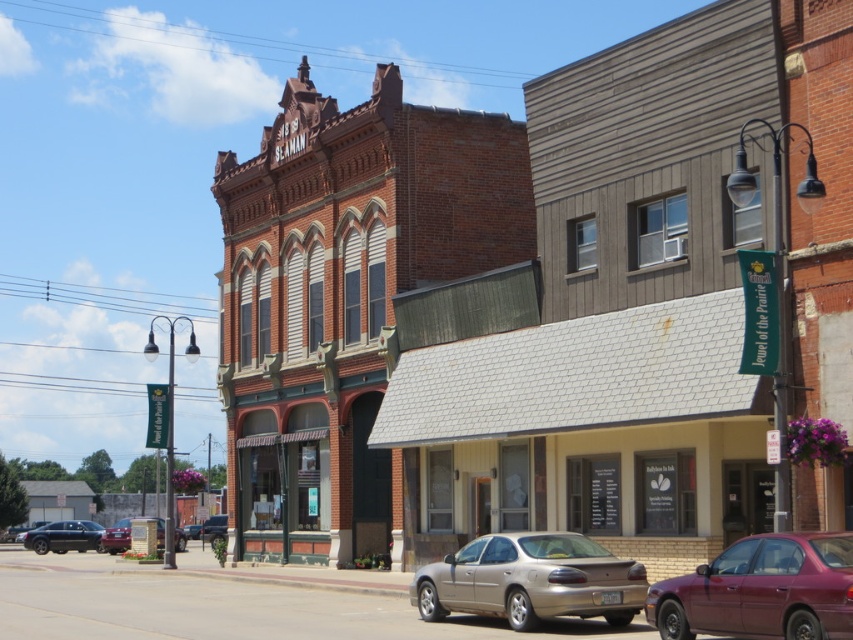
You are standing in the street scene and want to determine which of the two points, point (722, 576) or point (113, 531), is nearer to you. Based on the scene description, which point is closer?

Point (722, 576) is closer to the camera than point (113, 531), so it is the nearer one.

You are standing on the sidewalk in front of the Victorian building. You want to walk to the beige wood storefront at center. Which direction should you move?

You should move to the right because the beige wood storefront at center is located to the right of the Victorian building.